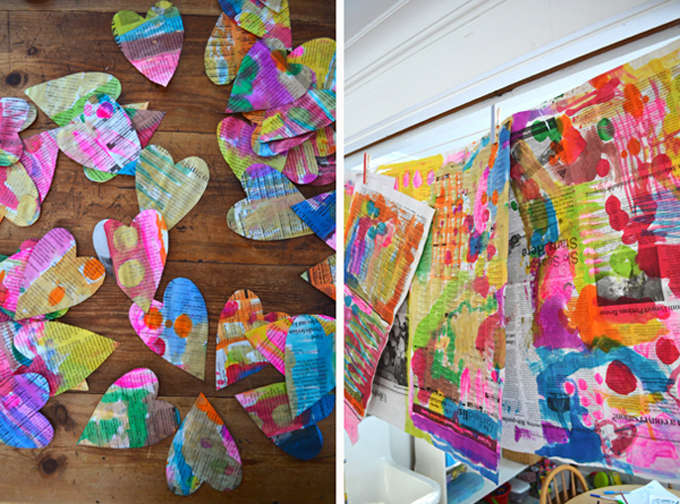
Find the location of a particular element. The image size is (680, 504). floor is located at coordinates (231, 263).